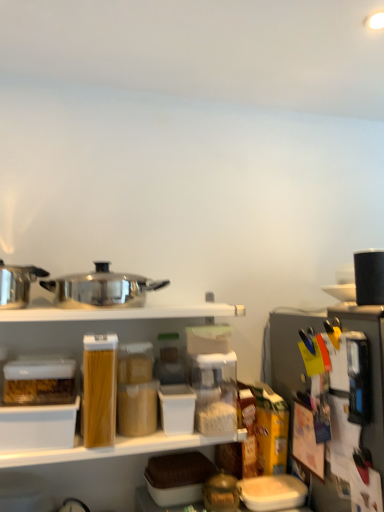
This screenshot has height=512, width=384. What are the coordinates of `vacant area on top of brown woven basket at center (from a real-world perspective)` in the screenshot? It's located at (180, 454).